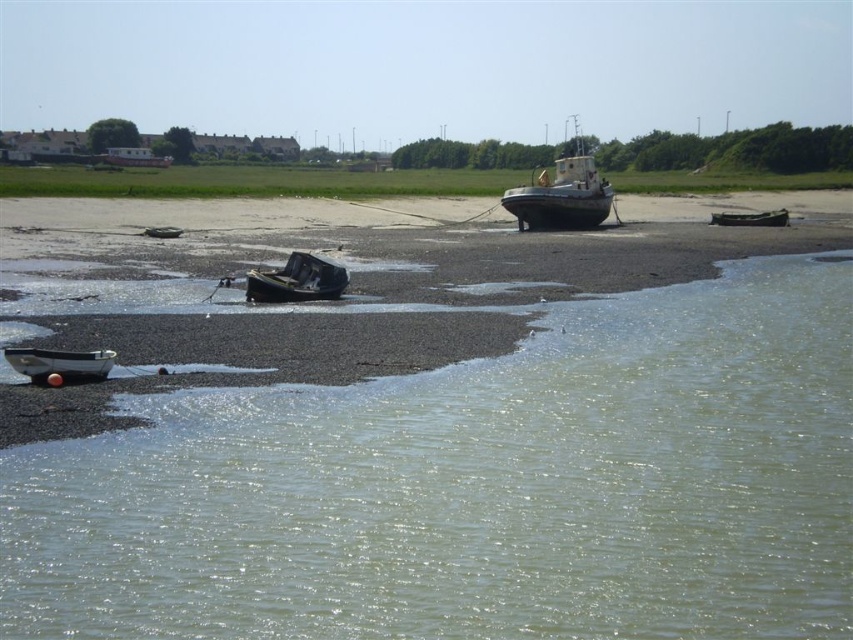
You are standing on the shore looking out at the scene. There is clear water at lower left and a wooden boat at center. Which object is positioned to the right of the other?

The clear water at lower left is to the right of the wooden boat at center.

You are a marine biologist planning to board one of the boats for a quick inspection. You need to choose the boat with more space to store your equipment. Which boat should you choose between the smooth gray boat at center and the rusty metal boat at center?

Answer: The smooth gray boat at center is wider than the rusty metal boat at center, so you should choose the smooth gray boat at center for more storage space.

You are a photographer positioned at the origin point of the image. You want to capture the smooth gray boat at center in your shot. According to the coordinates provided, in which direction should you move your camera to frame the boat properly?

The smooth gray boat at center is located at coordinates point (561, 193), so you should move your camera to the right and upwards to frame the boat properly.